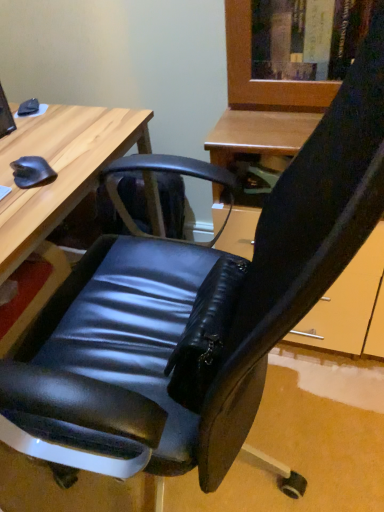
You are a GUI agent. You are given a task and a screenshot of the screen. Output one action in this format:
    pyautogui.click(x=<x>, y=<y>)
    Task: Click on the vacant area to the right of matte black monitor at upper left
    The width and height of the screenshot is (384, 512).
    Given the screenshot: What is the action you would take?
    pyautogui.click(x=47, y=129)